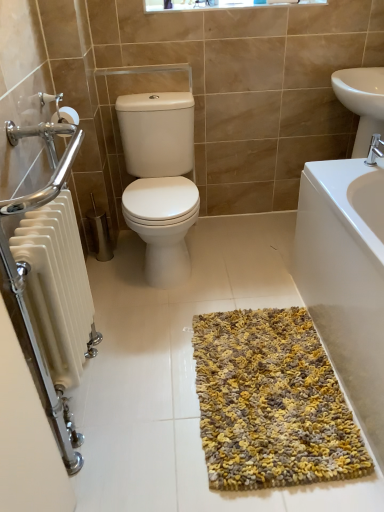
Question: Is white glossy sink at upper right smaller than yellow textured bath mat at lower right?

Choices:
 (A) no
 (B) yes

Answer: (B)

Question: From a real-world perspective, is white glossy sink at upper right on top of yellow textured bath mat at lower right?

Choices:
 (A) no
 (B) yes

Answer: (B)

Question: Are white glossy sink at upper right and yellow textured bath mat at lower right far apart?

Choices:
 (A) no
 (B) yes

Answer: (A)

Question: Is white glossy sink at upper right further to the viewer compared to yellow textured bath mat at lower right?

Choices:
 (A) yes
 (B) no

Answer: (A)

Question: Does white glossy sink at upper right have a lesser width compared to yellow textured bath mat at lower right?

Choices:
 (A) yes
 (B) no

Answer: (A)

Question: Is white glossy sink at upper right in contact with yellow textured bath mat at lower right?

Choices:
 (A) no
 (B) yes

Answer: (A)

Question: Can you confirm if white glossy toilet at center is positioned to the left of white plastic window frame at upper center?

Choices:
 (A) no
 (B) yes

Answer: (B)

Question: Can you confirm if white glossy toilet at center is shorter than white plastic window frame at upper center?

Choices:
 (A) yes
 (B) no

Answer: (B)

Question: Considering the relative sizes of white glossy toilet at center and white plastic window frame at upper center in the image provided, is white glossy toilet at center bigger than white plastic window frame at upper center?

Choices:
 (A) no
 (B) yes

Answer: (B)

Question: From a real-world perspective, does white glossy toilet at center stand above white plastic window frame at upper center?

Choices:
 (A) no
 (B) yes

Answer: (A)

Question: Considering the relative positions of white glossy toilet at center and white plastic window frame at upper center in the image provided, is white glossy toilet at center in front of white plastic window frame at upper center?

Choices:
 (A) no
 (B) yes

Answer: (B)

Question: From the image's perspective, is white glossy toilet at center on top of white plastic window frame at upper center?

Choices:
 (A) no
 (B) yes

Answer: (A)

Question: Considering the relative sizes of silver metallic faucet at upper right and yellow textured bath mat at lower right in the image provided, is silver metallic faucet at upper right taller than yellow textured bath mat at lower right?

Choices:
 (A) yes
 (B) no

Answer: (B)